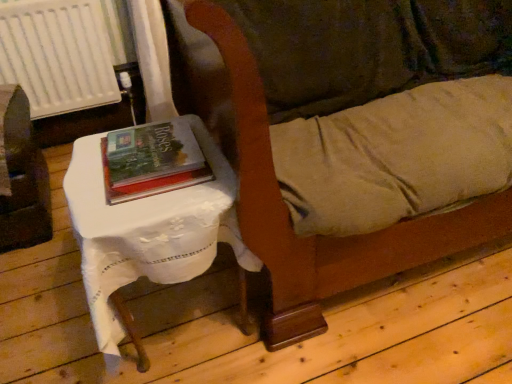
Question: From a real-world perspective, is velvet-like brown couch at center above or below hardcover book at center?

Choices:
 (A) below
 (B) above

Answer: (A)

Question: From their relative heights in the image, would you say velvet-like brown couch at center is taller or shorter than hardcover book at center?

Choices:
 (A) tall
 (B) short

Answer: (A)

Question: Estimate the real-world distances between objects in this image. Which object is closer to the hardcover book at center?

Choices:
 (A) velvet-like brown couch at center
 (B) white cloth-covered table at left
 (C) white plastic radiator at upper left
 (D) brushed metal table at left

Answer: (B)

Question: Which is farther from the hardcover book at center?

Choices:
 (A) velvet-like brown couch at center
 (B) white cloth-covered table at left
 (C) brushed metal table at left
 (D) white plastic radiator at upper left

Answer: (D)